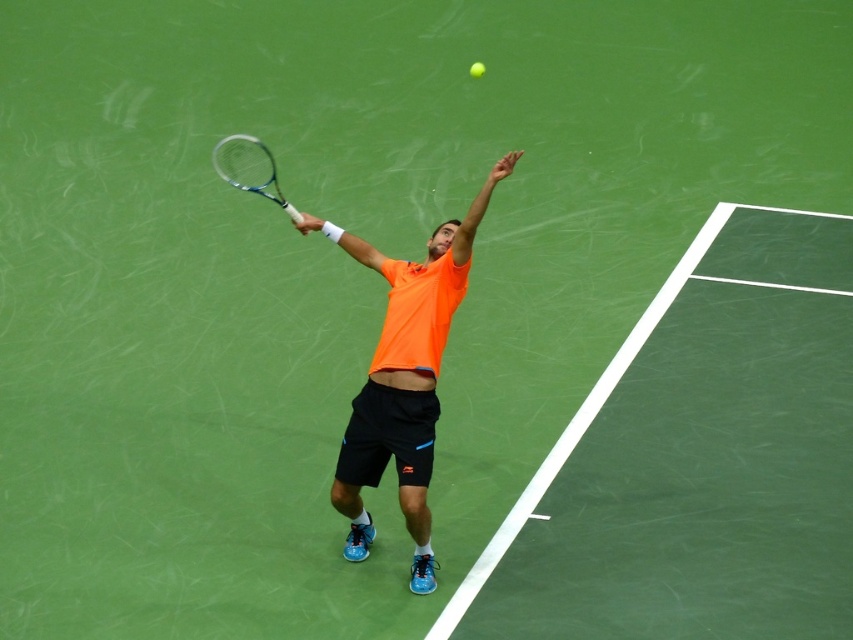
Who is more forward, (430, 355) or (477, 64)?

Positioned in front is point (430, 355).

Which is more to the right, orange fabric shirt at center or green matte tennis ball at upper center?

green matte tennis ball at upper center is more to the right.

Looking at this image, who is more distant from viewer, (x=357, y=456) or (x=477, y=72)?

Point (x=477, y=72)

Locate an element on the screen. The width and height of the screenshot is (853, 640). orange fabric shirt at center is located at coordinates (405, 374).

Is orange fabric shirt at center below silver metallic tennis racket at upper center?

Indeed, orange fabric shirt at center is positioned under silver metallic tennis racket at upper center.

Is point (426, 534) less distant than point (264, 177)?

Yes.

Is point (424, 557) positioned in front of point (253, 160)?

That is True.

What are the coordinates of `orange fabric shirt at center` in the screenshot? It's located at (405, 374).

Is silver metallic tennis racket at upper center smaller than green matte tennis ball at upper center?

No.

Between silver metallic tennis racket at upper center and green matte tennis ball at upper center, which one is positioned higher?

Positioned higher is green matte tennis ball at upper center.

Is point (223, 163) positioned in front of point (476, 70)?

That is True.

You are a GUI agent. You are given a task and a screenshot of the screen. Output one action in this format:
    pyautogui.click(x=<x>, y=<y>)
    Task: Click on the silver metallic tennis racket at upper center
    Image resolution: width=853 pixels, height=640 pixels.
    Given the screenshot: What is the action you would take?
    pyautogui.click(x=250, y=168)